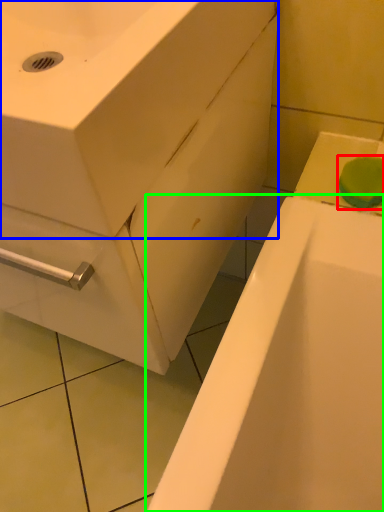
Question: Which is nearer to the soap (highlighted by a red box)? sink (highlighted by a blue box) or bathtub (highlighted by a green box).

Choices:
 (A) sink
 (B) bathtub

Answer: (B)